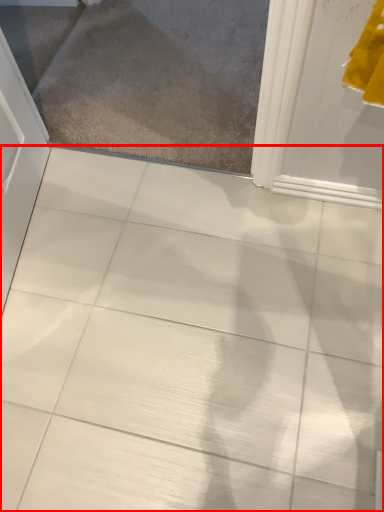
Question: From the image's perspective, what is the correct spatial relationship of ceramic tile (annotated by the red box) in relation to glass door?

Choices:
 (A) below
 (B) above

Answer: (A)